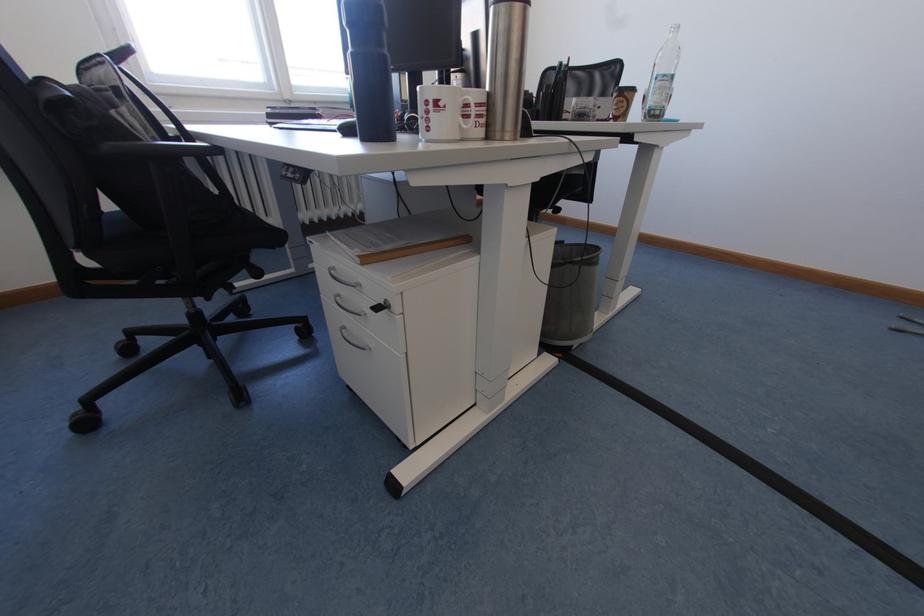
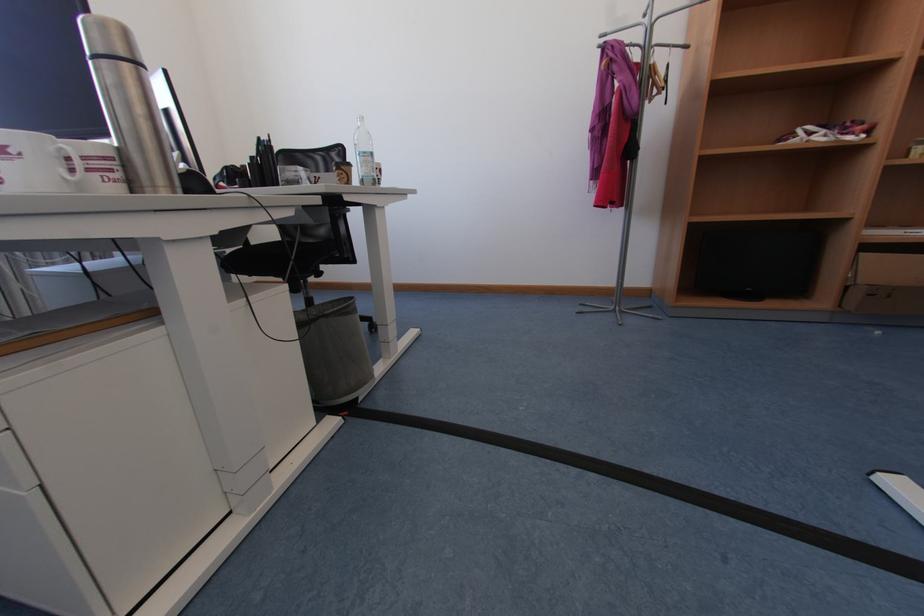
Question: The camera is either moving clockwise (left) or counter-clockwise (right) around the object. The first image is from the beginning of the video and the second image is from the end. Is the camera moving left or right when shooting the video?

Choices:
 (A) Left
 (B) Right

Answer: (A)